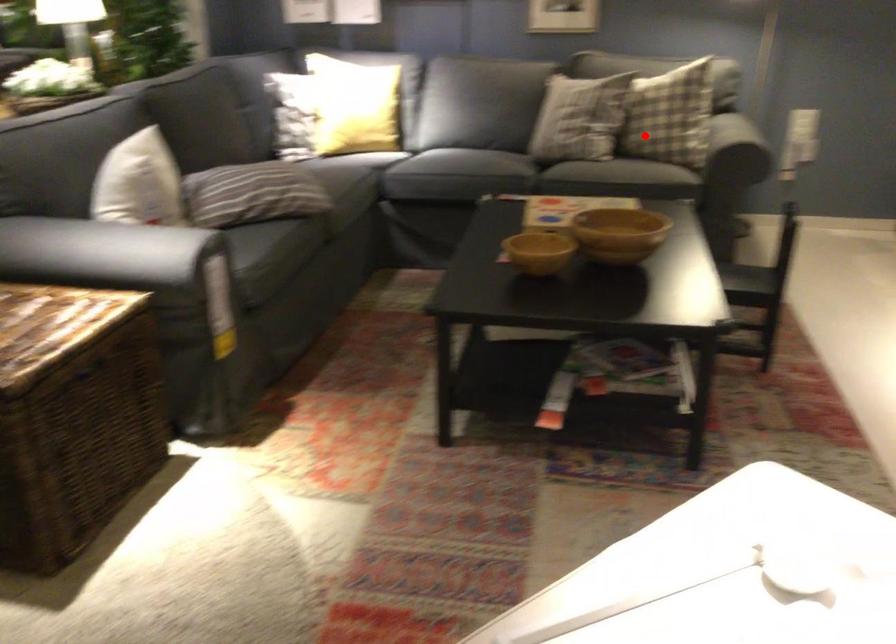
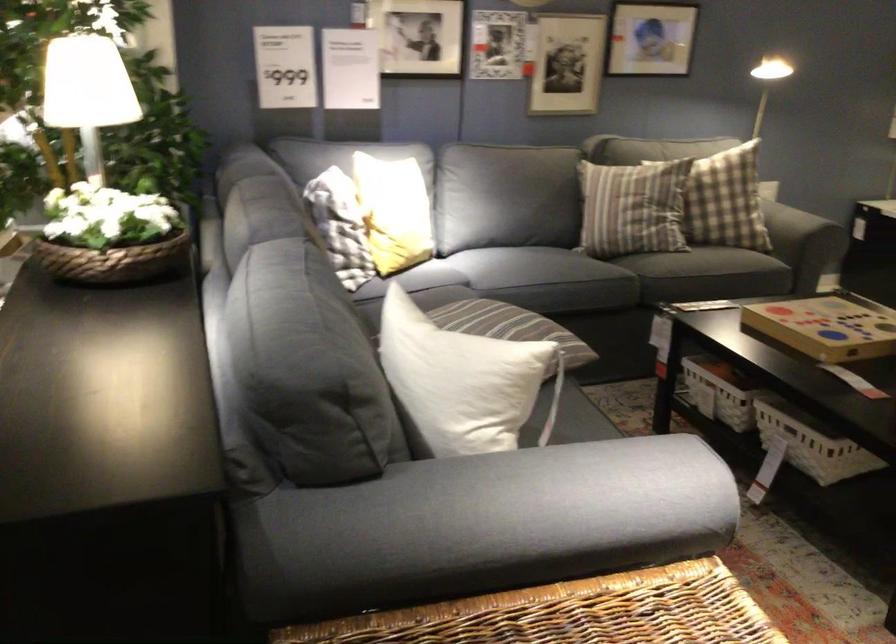
In the second image, find the point that corresponds to the highlighted location in the first image.

(798, 223)